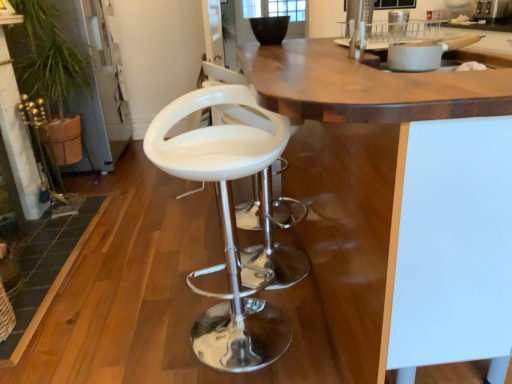
Question: Considering the relative sizes of white ceramic pot at upper right and wooden at center in the image provided, is white ceramic pot at upper right thinner than wooden at center?

Choices:
 (A) yes
 (B) no

Answer: (A)

Question: From the image's perspective, does white ceramic pot at upper right appear lower than wooden at center?

Choices:
 (A) yes
 (B) no

Answer: (B)

Question: From a real-world perspective, is white ceramic pot at upper right physically above wooden at center?

Choices:
 (A) no
 (B) yes

Answer: (B)

Question: Does white ceramic pot at upper right have a lesser height compared to wooden at center?

Choices:
 (A) yes
 (B) no

Answer: (A)

Question: Considering the relative positions of white ceramic pot at upper right and wooden at center in the image provided, is white ceramic pot at upper right to the right of wooden at center from the viewer's perspective?

Choices:
 (A) no
 (B) yes

Answer: (B)

Question: Does white ceramic pot at upper right touch wooden at center?

Choices:
 (A) yes
 (B) no

Answer: (B)

Question: Could you tell me if white ceramic pot at upper right is facing white glossy bar stool at center?

Choices:
 (A) yes
 (B) no

Answer: (B)

Question: From the image's perspective, is white ceramic pot at upper right under white glossy bar stool at center?

Choices:
 (A) yes
 (B) no

Answer: (B)

Question: Can white glossy bar stool at center be found inside white ceramic pot at upper right?

Choices:
 (A) yes
 (B) no

Answer: (B)

Question: From a real-world perspective, is white ceramic pot at upper right located higher than white glossy bar stool at center?

Choices:
 (A) no
 (B) yes

Answer: (B)

Question: Is white ceramic pot at upper right at the left side of white glossy bar stool at center?

Choices:
 (A) no
 (B) yes

Answer: (A)

Question: Is white ceramic pot at upper right in front of white glossy bar stool at center?

Choices:
 (A) no
 (B) yes

Answer: (A)

Question: From a real-world perspective, is wooden at center physically above white ceramic pot at upper right?

Choices:
 (A) no
 (B) yes

Answer: (A)